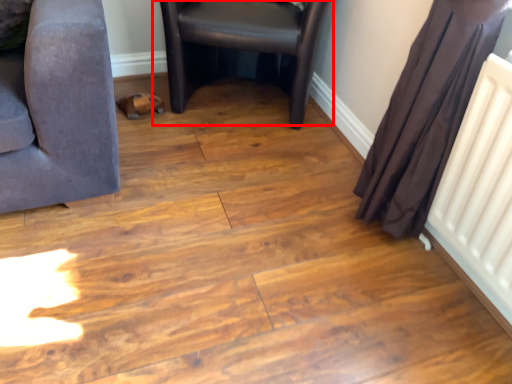
Question: From the image's perspective, what is the correct spatial relationship of chair (annotated by the red box) in relation to curtain?

Choices:
 (A) above
 (B) below

Answer: (A)